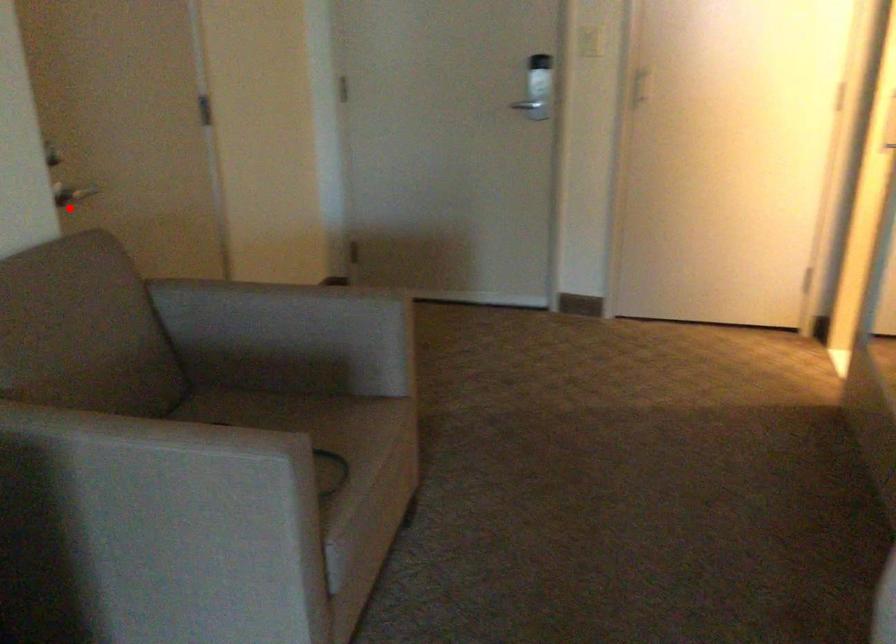
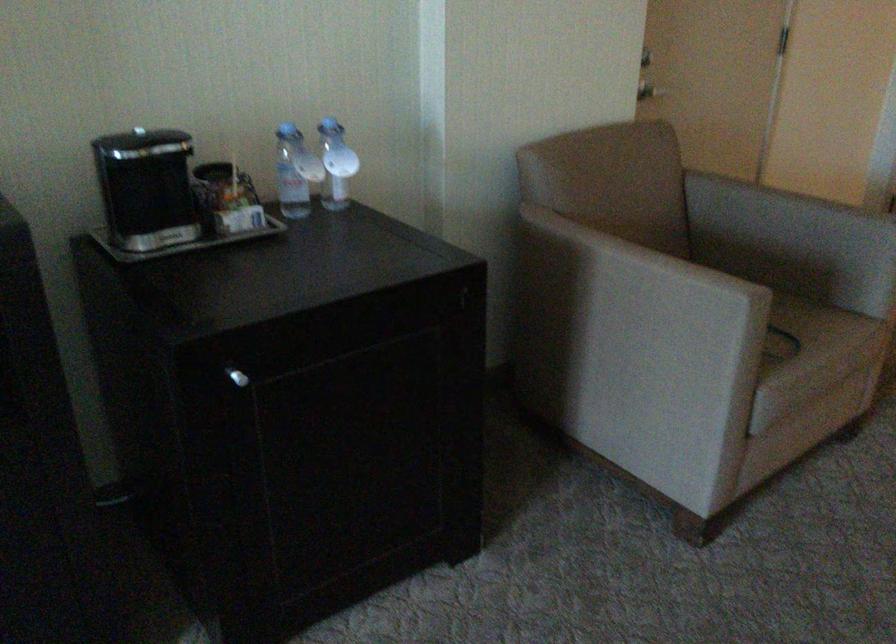
Where in the second image is the point corresponding to the highlighted location from the first image?

(649, 90)